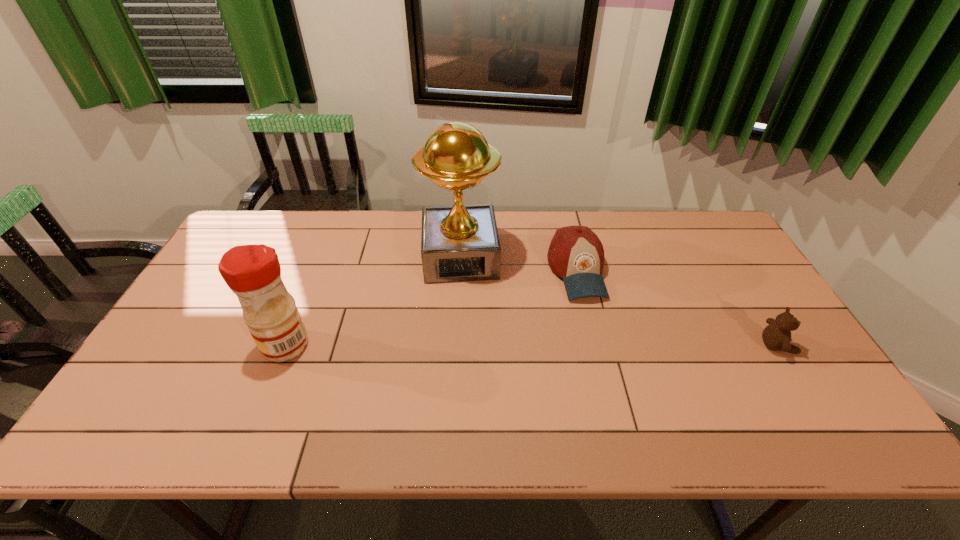
Where is `the leftmost object`? the leftmost object is located at coordinates (252, 272).

This screenshot has height=540, width=960. Identify the location of condiment. (252, 272).

Locate an element on the screen. This screenshot has width=960, height=540. the rightmost object is located at coordinates (777, 335).

Find the location of a particular element. This screenshot has width=960, height=540. the third object from right to left is located at coordinates (459, 243).

What are the coordinates of `the tallest object` in the screenshot? It's located at (459, 243).

The width and height of the screenshot is (960, 540). Find the location of `baseball cap`. baseball cap is located at coordinates (576, 254).

Locate an element on the screen. The height and width of the screenshot is (540, 960). vacant position located on the right of the second tallest object is located at coordinates (396, 345).

Identify the location of vacant region located on the front-facing side of the second object from left to right. This screenshot has width=960, height=540. pyautogui.click(x=466, y=332).

In order to click on blank space located on the front-facing side of the second object from left to right in this screenshot , I will do `click(466, 327)`.

The image size is (960, 540). I want to click on blank area located 0.120m on the front-facing side of the second object from left to right, so click(465, 313).